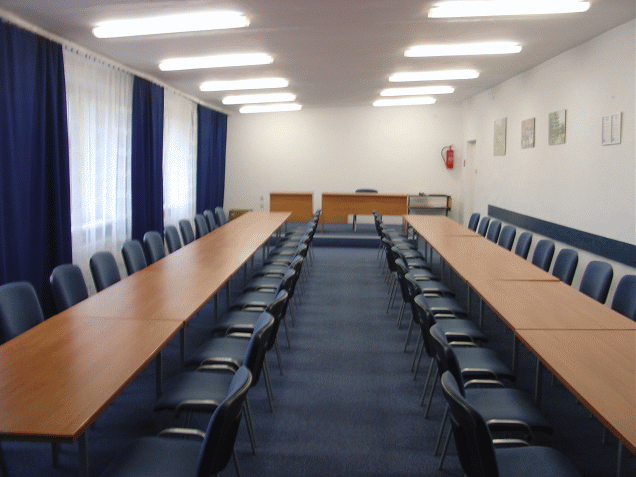
At what (x,y) coordinates should I click in order to perform the action: click on pictures on wall. Please return your answer as a coordinate pair (x, y). The image size is (636, 477). Looking at the image, I should click on (498, 139), (525, 144), (556, 134), (605, 137).